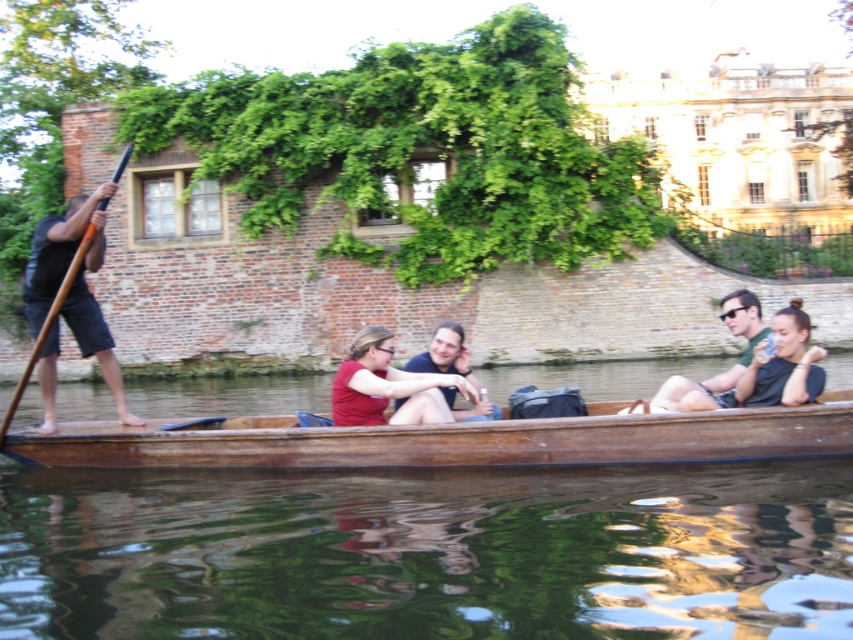
You are a photographer taking pictures of the passengers on the punt boat. You notice the matte red shirt at center and the matte black shirt at center. Which passenger is shorter in height?

The matte red shirt at center is shorter in height than the matte black shirt at center according to the description.

You are standing on the riverbank and want to throw a small ball to someone on the punt boat. You notice two points marked on the boat. Which point is closer to you, point (410, 404) or point (640, 406)?

A: Point (410, 404) is closer to the viewer than point (640, 406), so you should aim for that point.

You are a photographer trying to capture the wooden canoe at center and the wooden paddle at left in the same frame. Based on their positions, which object should you focus on first to ensure both are in the shot?

The wooden paddle at left is positioned to the left of the wooden canoe at center. To include both in the frame, focus on the wooden paddle at left first as it is further to the left, allowing the canoe to be captured to its right.